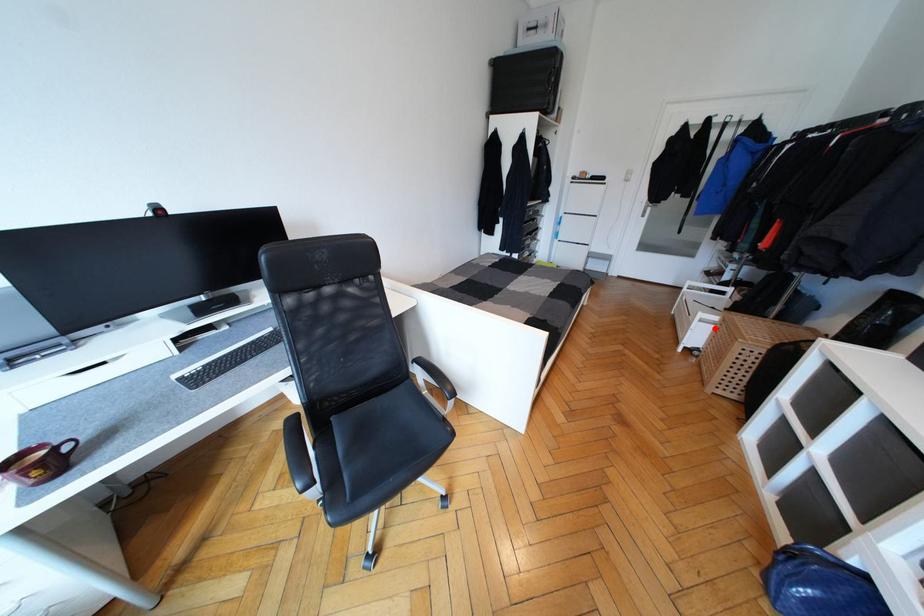
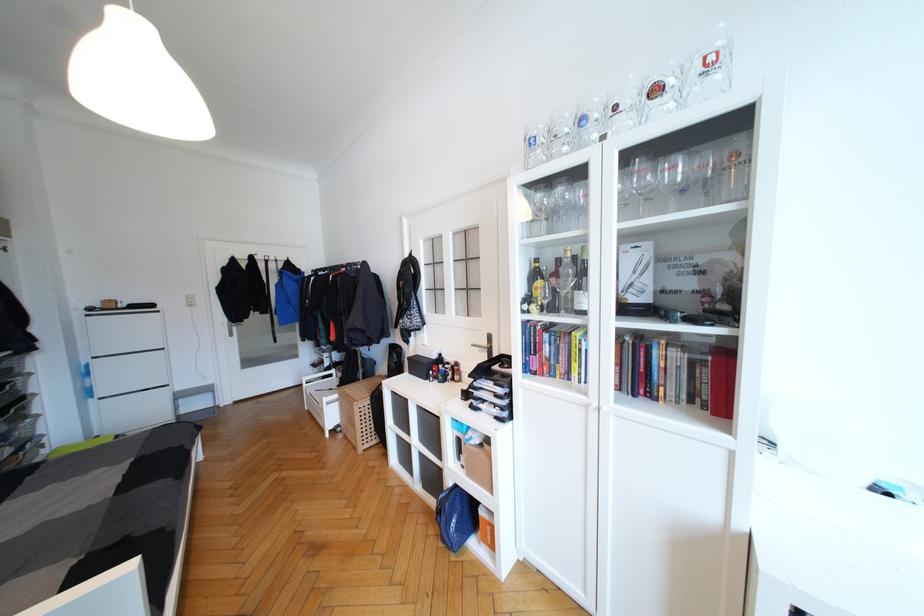
Question: I am providing you with two images of the same scene from different viewpoints. A red point is marked on the first image. Can you still see the location of the red point in image 2?

Choices:
 (A) Yes
 (B) No

Answer: (A)